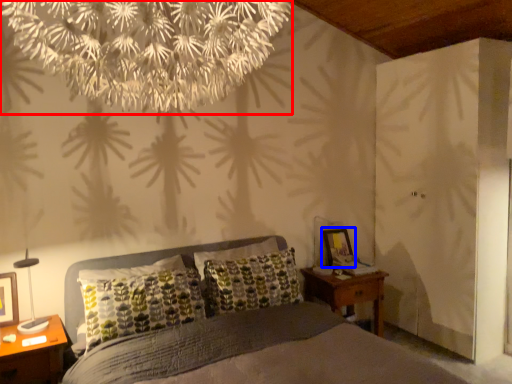
Question: Which object appears farthest to the camera in this image, flower (highlighted by a red box) or picture frame (highlighted by a blue box)?

Choices:
 (A) flower
 (B) picture frame

Answer: (B)